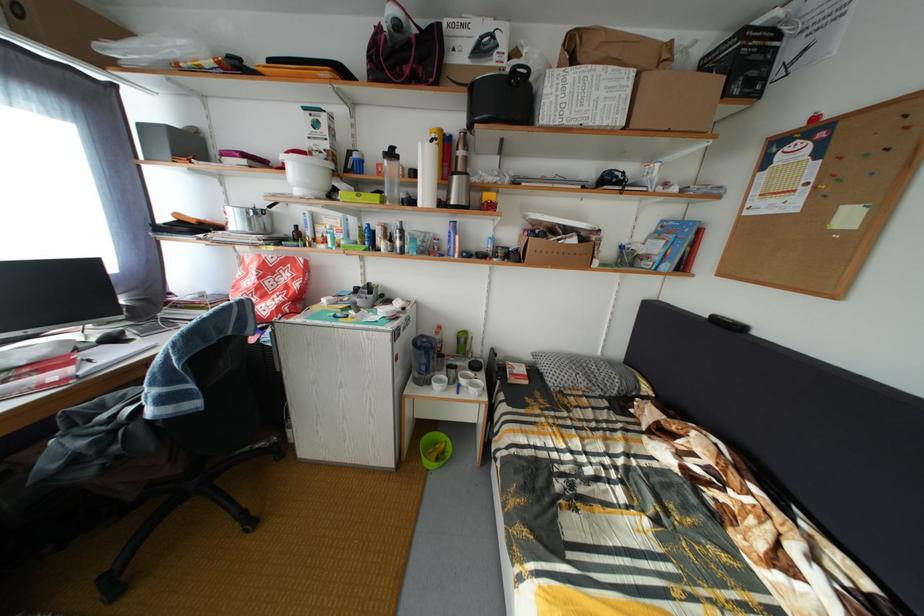
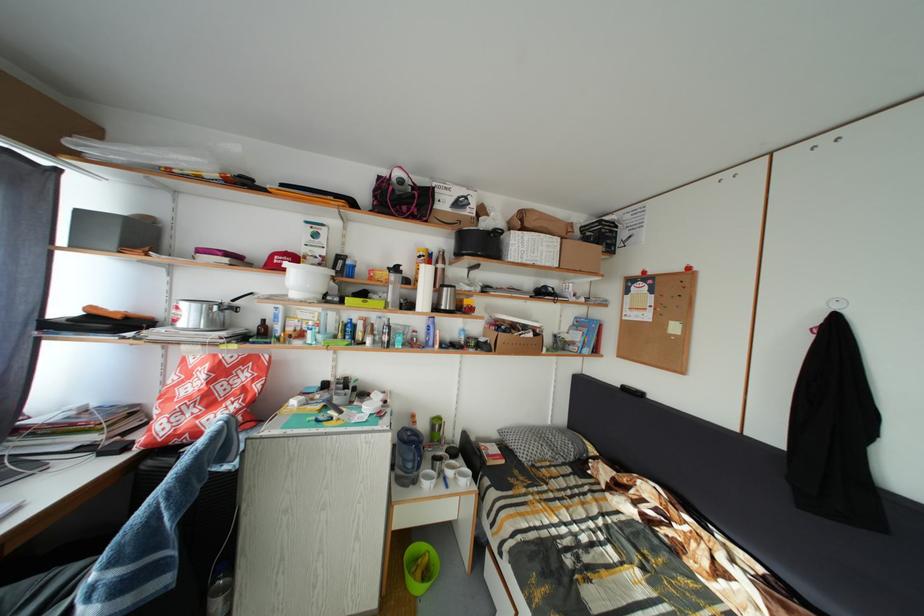
Where in the second image is the point corresponding to (582,246) from the first image?

(540, 341)